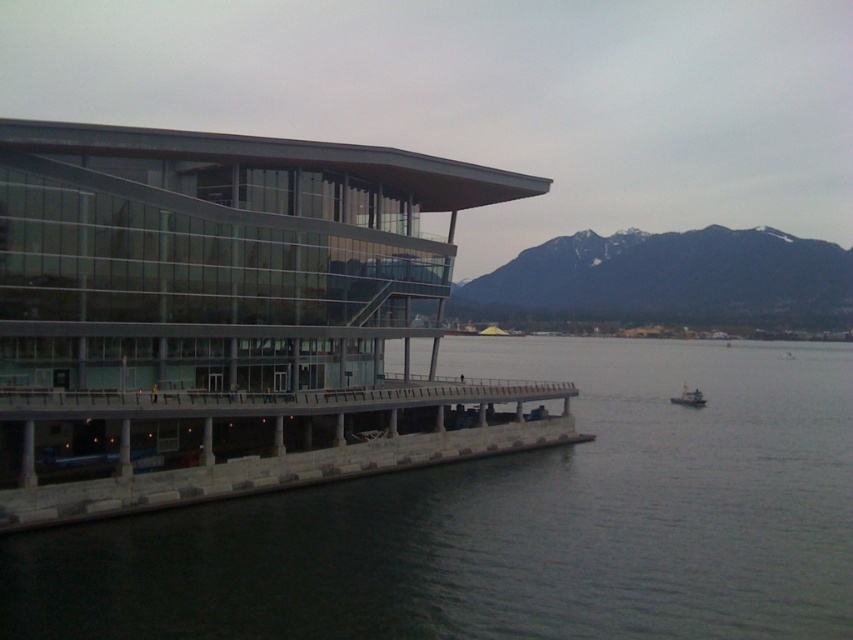
Question: Can you confirm if dark gray rocky mountain at upper center is wider than concrete dock at lower left?

Choices:
 (A) yes
 (B) no

Answer: (A)

Question: Is concrete dock at lower left positioned in front of gray metallic boat at center-right?

Choices:
 (A) no
 (B) yes

Answer: (B)

Question: Among these objects, which one is nearest to the camera?

Choices:
 (A) gray metallic boat at center-right
 (B) concrete dock at lower left
 (C) transparent water at lower left

Answer: (C)

Question: Which point appears farthest from the camera in this image?

Choices:
 (A) (276, 406)
 (B) (669, 401)
 (C) (635, 278)

Answer: (C)

Question: Is transparent water at lower left below gray metallic boat at center-right?

Choices:
 (A) yes
 (B) no

Answer: (B)

Question: Which of the following is the farthest from the observer?

Choices:
 (A) transparent water at lower left
 (B) gray metallic boat at center-right
 (C) concrete dock at lower left
 (D) dark gray rocky mountain at upper center

Answer: (D)